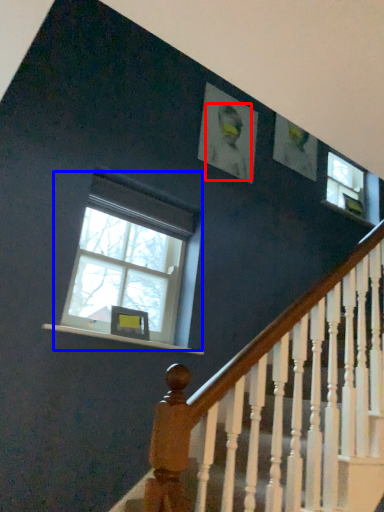
Question: Which point is closer to the camera, person (highlighted by a red box) or window (highlighted by a blue box)?

Choices:
 (A) person
 (B) window

Answer: (B)